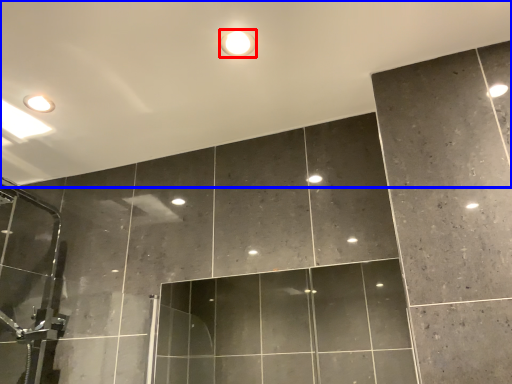
Question: Which object is closer to the camera taking this photo, droplight (highlighted by a red box) or backdrop (highlighted by a blue box)?

Choices:
 (A) droplight
 (B) backdrop

Answer: (B)